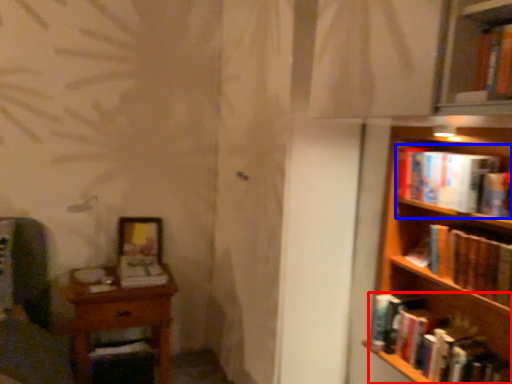
Question: Which point is further to the camera, book (highlighted by a red box) or book (highlighted by a blue box)?

Choices:
 (A) book
 (B) book

Answer: (B)